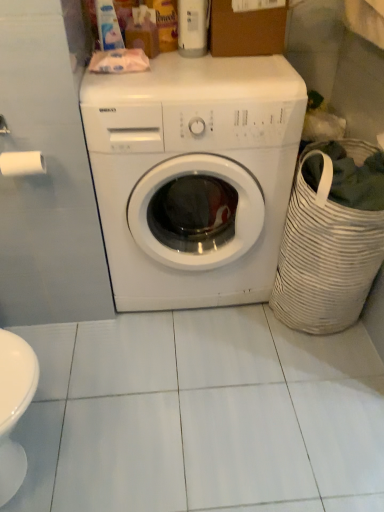
You are a GUI agent. You are given a task and a screenshot of the screen. Output one action in this format:
    pyautogui.click(x=<x>, y=<y>)
    Task: Click on the vacant region in front of white woven laundry basket at right
    The width and height of the screenshot is (384, 512).
    Given the screenshot: What is the action you would take?
    pyautogui.click(x=315, y=384)